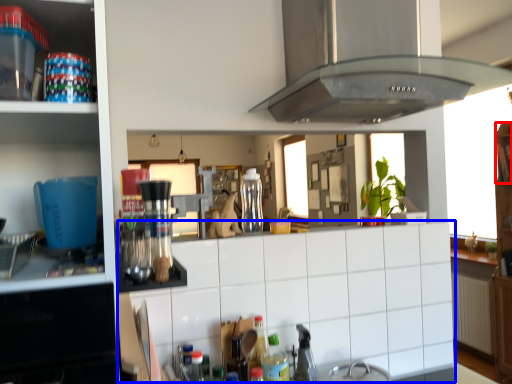
Question: Which object appears farthest to the camera in this image, shelf (highlighted by a red box) or counter top (highlighted by a blue box)?

Choices:
 (A) shelf
 (B) counter top

Answer: (A)